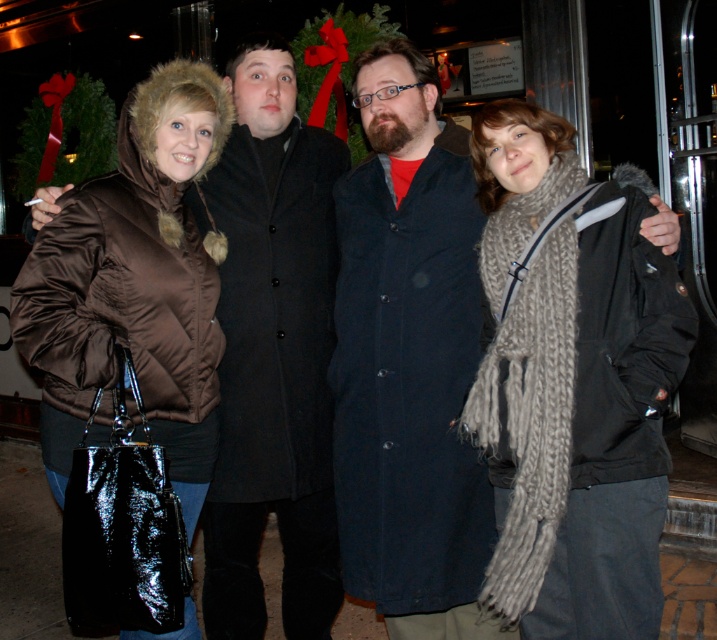
You are a photographer trying to capture a closeup of the knitted gray scarf at center and the brown shiny coat at left. Based on their positions, which object should you focus on first if you want to ensure both are in focus without adjusting the camera settings?

The knitted gray scarf at center is below the brown shiny coat at left, so you should focus on the brown shiny coat at left first since it is closer to the camera. This way, the scarf, being behind it, will also be in focus if the depth of field allows.

You are standing in the festive outdoor scene with four people. You need to determine which of the two points, point (384, 579) or point (191, 458), is closer to you. Which one is closer?

Point (384, 579) is closer to the viewer than point (191, 458).

From the picture: You are a photographer trying to capture a closeup of the knitted gray scarf at center and the dark blue wool coat at center. Which object should you focus on first if you want to ensure both are in focus without adjusting the camera settings?

The knitted gray scarf at center has a lesser height compared to dark blue wool coat at center, so you should focus on the dark blue wool coat at center first as it is taller and requires a greater depth of field to capture details properly.